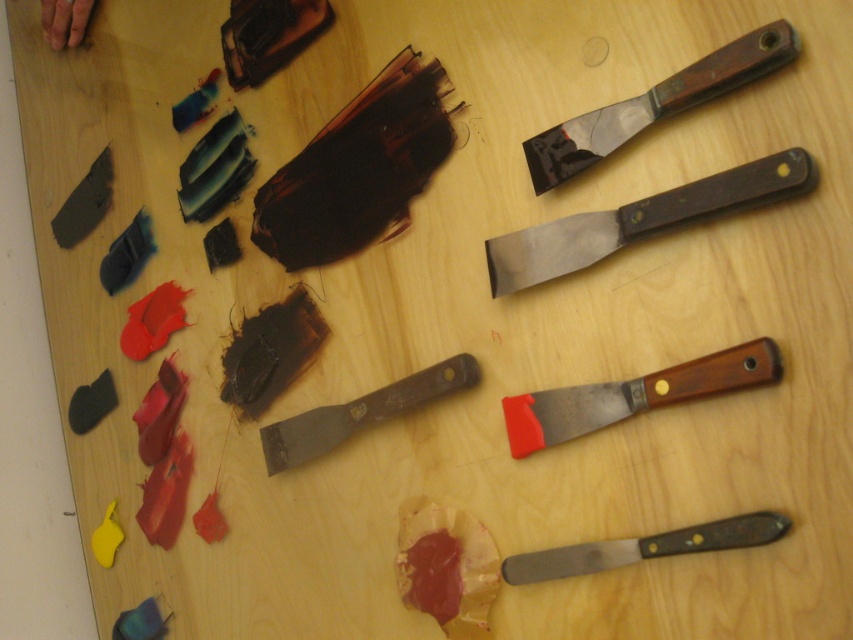
In the scene shown: Between wooden-handled spatula at center-right and metallic silver knife at bottom right, which one is positioned higher?

Positioned higher is wooden-handled spatula at center-right.

Is wooden-handled spatula at center-right to the right of metallic silver knife at bottom right from the viewer's perspective?

No, wooden-handled spatula at center-right is not to the right of metallic silver knife at bottom right.

Locate an element on the screen. The width and height of the screenshot is (853, 640). wooden-handled spatula at center-right is located at coordinates (631, 396).

Does point (508, 262) come farther from viewer compared to point (735, 348)?

Yes, it is.

Identify the location of wooden-handled putty knife at upper right. tap(637, 220).

Does wooden-handled putty knife at upper right appear over wooden-handled putty knife at center?

Correct, wooden-handled putty knife at upper right is located above wooden-handled putty knife at center.

Measure the distance from wooden-handled putty knife at upper right to wooden-handled putty knife at center.

wooden-handled putty knife at upper right is 8.32 inches from wooden-handled putty knife at center.

Is point (618, 241) positioned in front of point (398, 413)?

Yes, it is in front of point (398, 413).

This screenshot has width=853, height=640. Find the location of `wooden-handled putty knife at upper right`. wooden-handled putty knife at upper right is located at coordinates coord(637,220).